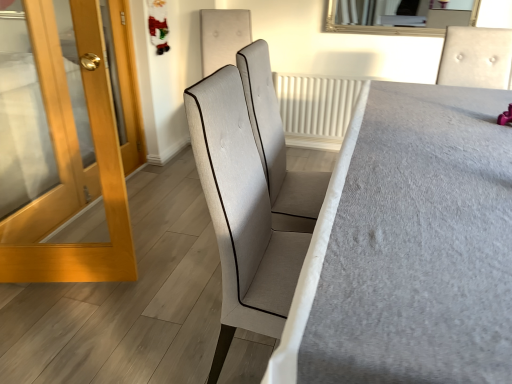
Question: Is textured fabric chair at center behind light gray fabric chair at center, the first chair positioned from the left?

Choices:
 (A) yes
 (B) no

Answer: (B)

Question: Can you confirm if textured fabric chair at center is wider than light gray fabric chair at center, marked as the 2th chair in a back-to-front arrangement?

Choices:
 (A) yes
 (B) no

Answer: (A)

Question: Would you say textured fabric chair at center contains light gray fabric chair at center, the first chair positioned from the left?

Choices:
 (A) no
 (B) yes

Answer: (A)

Question: Considering the relative sizes of textured fabric chair at center and light gray fabric chair at center, marked as the 2th chair in a back-to-front arrangement, in the image provided, is textured fabric chair at center smaller than light gray fabric chair at center, marked as the 2th chair in a back-to-front arrangement,?

Choices:
 (A) yes
 (B) no

Answer: (B)

Question: Is textured fabric chair at center looking in the opposite direction of light gray fabric chair at center, the first chair positioned from the left?

Choices:
 (A) yes
 (B) no

Answer: (B)

Question: Is textured fabric chair at center to the left of light gray fabric chair at center, which ranks as the 1th chair in front-to-back order, from the viewer's perspective?

Choices:
 (A) no
 (B) yes

Answer: (A)

Question: Is light gray fabric chair at upper right, which is the 2th chair from left to right, directly adjacent to wooden glossy door at left?

Choices:
 (A) yes
 (B) no

Answer: (B)

Question: Can you confirm if light gray fabric chair at upper right, placed as the 1th chair when sorted from right to left, is shorter than wooden glossy door at left?

Choices:
 (A) no
 (B) yes

Answer: (B)

Question: Is light gray fabric chair at upper right, arranged as the 2th chair when viewed from the front, completely or partially outside of wooden glossy door at left?

Choices:
 (A) no
 (B) yes

Answer: (B)

Question: From the image's perspective, is light gray fabric chair at upper right, which is the 2th chair from left to right, beneath wooden glossy door at left?

Choices:
 (A) no
 (B) yes

Answer: (A)

Question: Is light gray fabric chair at upper right, placed as the 1th chair when sorted from right to left, further to the viewer compared to wooden glossy door at left?

Choices:
 (A) yes
 (B) no

Answer: (A)

Question: Does light gray fabric chair at upper right, which is the 2th chair from left to right, have a smaller size compared to wooden glossy door at left?

Choices:
 (A) no
 (B) yes

Answer: (B)

Question: Is wooden glossy door at left placed right next to textured fabric chair at center?

Choices:
 (A) no
 (B) yes

Answer: (A)